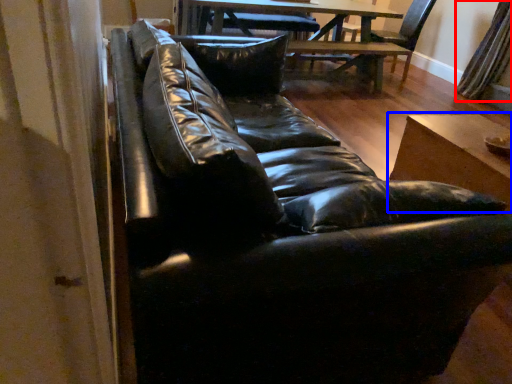
Question: Among these objects, which one is farthest to the camera, curtain (highlighted by a red box) or table (highlighted by a blue box)?

Choices:
 (A) curtain
 (B) table

Answer: (A)